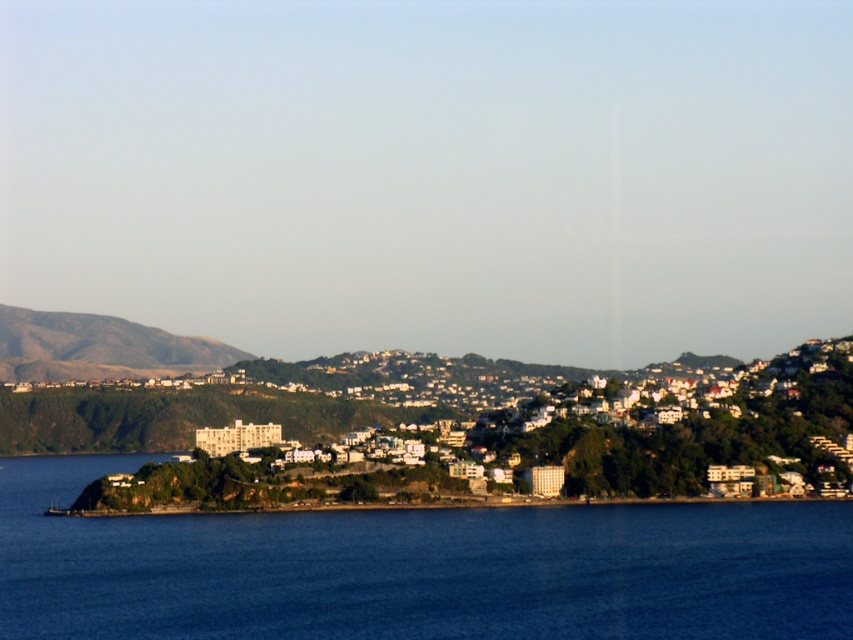
Between point (15, 534) and point (734, 438), which one is positioned in front?

Point (734, 438) is in front.

Does blue liquid water at lower left have a smaller size compared to white matte building at center?

Actually, blue liquid water at lower left might be larger than white matte building at center.

Looking at this image, measure the distance between blue liquid water at lower left and camera.

blue liquid water at lower left is 2139.88 feet away from camera.

Where is `blue liquid water at lower left`? This screenshot has width=853, height=640. blue liquid water at lower left is located at coordinates (416, 568).

Between white matte building at center and rustic brown hillside at left, which one has less height?

Standing shorter between the two is rustic brown hillside at left.

Is white matte building at center taller than rustic brown hillside at left?

Yes.

Which is behind, point (511, 436) or point (53, 378)?

The point (53, 378) is behind.

Where is `white matte building at center`? white matte building at center is located at coordinates (630, 420).

Is point (506, 625) less distant than point (64, 349)?

That is True.

Does blue liquid water at lower left have a lesser width compared to rustic brown hillside at left?

No, blue liquid water at lower left is not thinner than rustic brown hillside at left.

Does point (289, 627) come farther from viewer compared to point (141, 360)?

No, (289, 627) is closer to viewer.

What are the coordinates of `blue liquid water at lower left` in the screenshot? It's located at (416, 568).